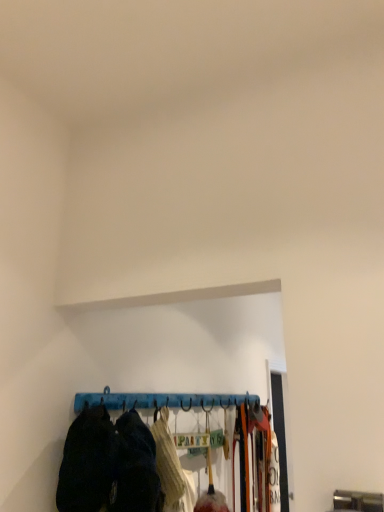
This screenshot has width=384, height=512. What do you see at coordinates (171, 468) in the screenshot?
I see `knitted wool sweater at center` at bounding box center [171, 468].

The width and height of the screenshot is (384, 512). I want to click on knitted wool sweater at center, so click(171, 468).

This screenshot has width=384, height=512. In order to click on knitted wool sweater at center in this screenshot , I will do point(171,468).